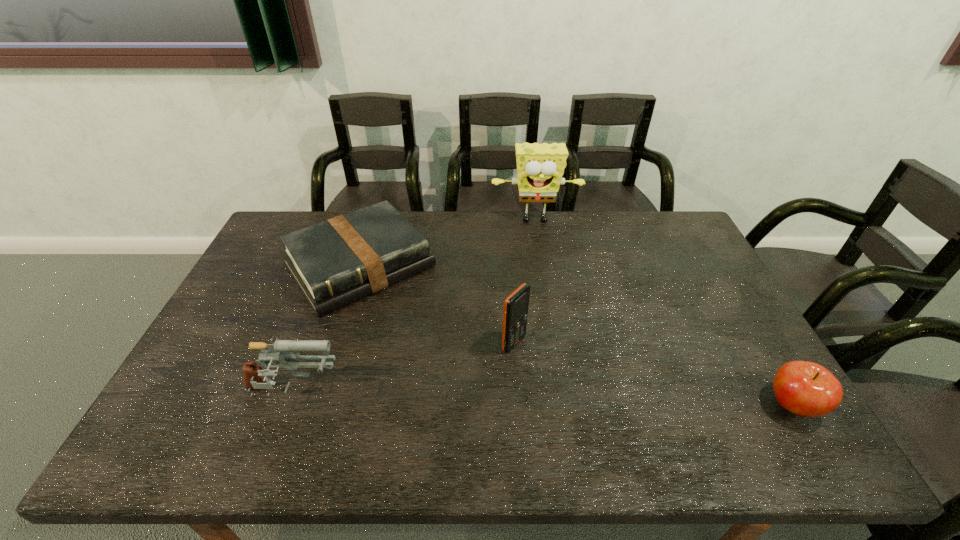
I want to click on vacant space on the desktop that is between the third shortest object and the second shortest object and is positioned on the spine side of the hardback book, so click(x=468, y=397).

Identify the location of vacant spot on the desktop that is between the third tallest object and the rightmost object and is positioned on the screen of the third nearest object. (605, 401).

Find the location of a particular element. The image size is (960, 540). free space on the desktop that is between the gun and the rightmost object and is positioned on the front-facing side of the tallest object is located at coordinates coord(561,400).